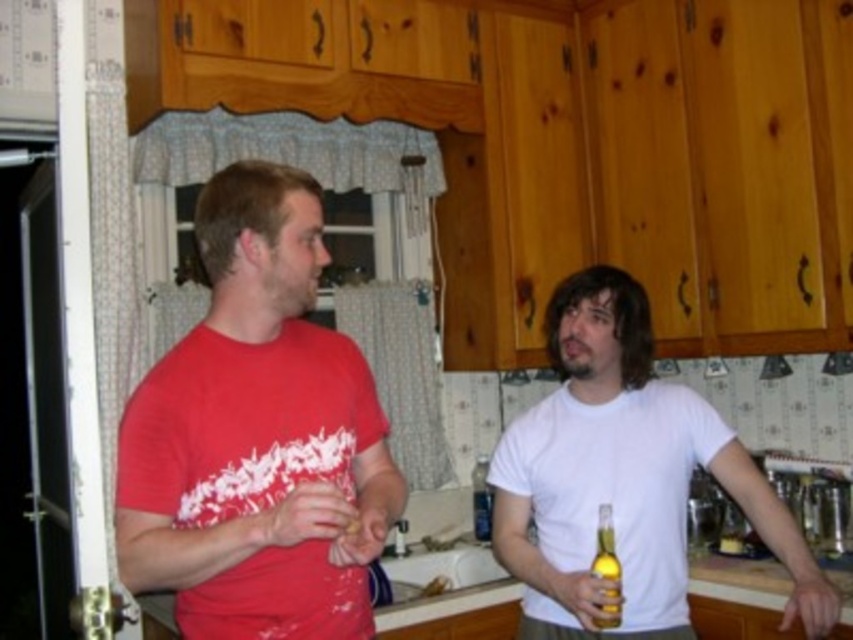
You are standing in the kitchen and want to reach a point that is exactly at coordinates point (606, 515). If your arm can extend 1.8 meters, can you reach that point?

The distance of point (606, 515) from camera is 1.77 meters, so yes, you can reach it since your arm can extend 1.8 meters which is longer than the distance to the point.

You are a guest in this kitchen and need to grab a drink. You see the yellow glass bottle at lower right and the translucent glass bottle at center. Which one is closer to the floor?

The translucent glass bottle at center is closer to the floor since the yellow glass bottle at lower right is positioned above it.